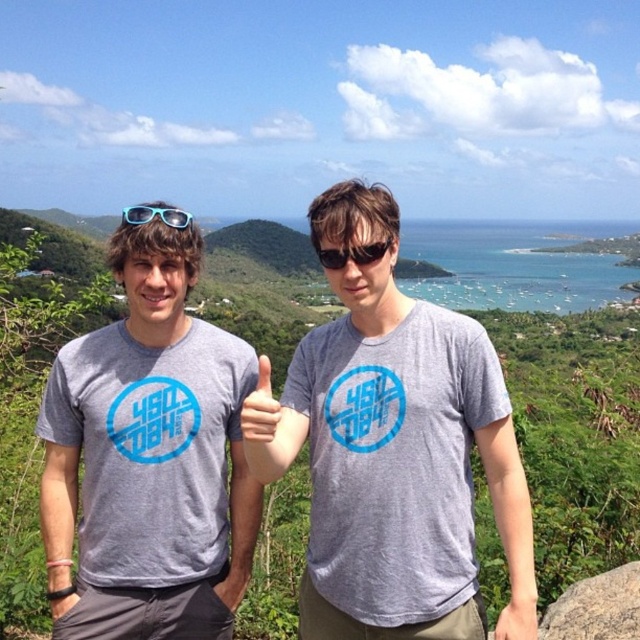
Is matte gray t-shirt at center shorter than gray rough rock at lower right?

No.

Is matte gray t-shirt at center thinner than gray rough rock at lower right?

No.

At what (x,y) coordinates should I click in order to perform the action: click on matte gray t-shirt at center. Please return your answer as a coordinate pair (x, y). The width and height of the screenshot is (640, 640). Looking at the image, I should click on [x=148, y=458].

Does gray cotton t-shirt at center have a greater height compared to blue plastic sunglasses at upper left?

Yes.

This screenshot has width=640, height=640. In order to click on gray cotton t-shirt at center in this screenshot , I will do `click(394, 449)`.

Is matte gray t-shirt at center bigger than blue plastic sunglasses at upper left?

Incorrect, matte gray t-shirt at center is not larger than blue plastic sunglasses at upper left.

Between matte gray t-shirt at center and blue plastic sunglasses at upper left, which one appears on the right side from the viewer's perspective?

From the viewer's perspective, matte gray t-shirt at center appears more on the right side.

Is point (221, 628) less distant than point (172, 205)?

No, (221, 628) is behind (172, 205).

Identify the location of matte gray t-shirt at center. This screenshot has height=640, width=640. (148, 458).